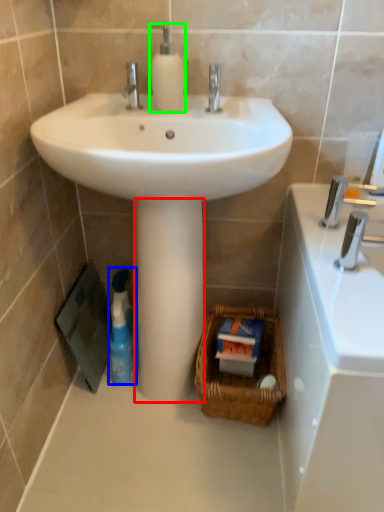
Question: Which object is the closest to the pillar (highlighted by a red box)? Choose among these: cleaning product (highlighted by a blue box) or soap dispenser (highlighted by a green box).

Choices:
 (A) cleaning product
 (B) soap dispenser

Answer: (A)